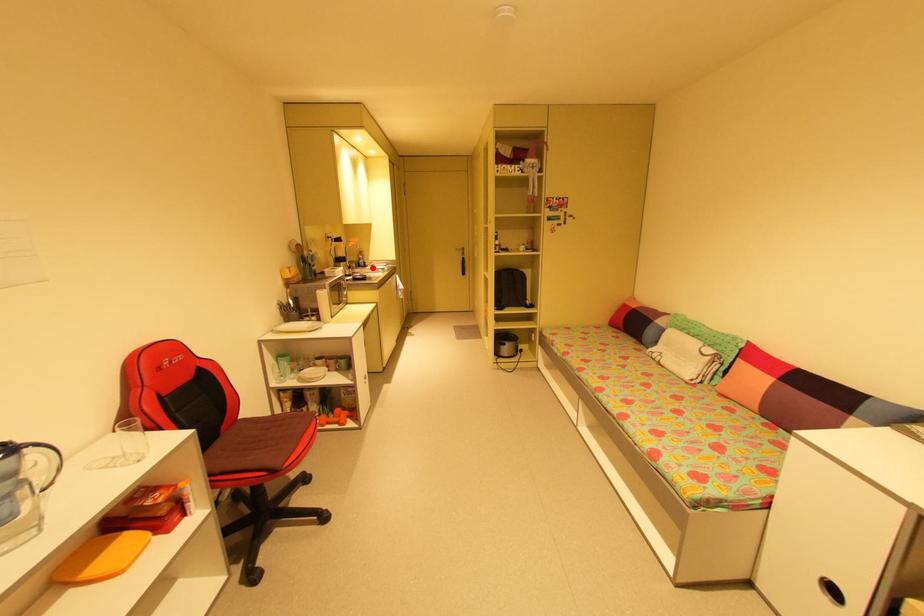
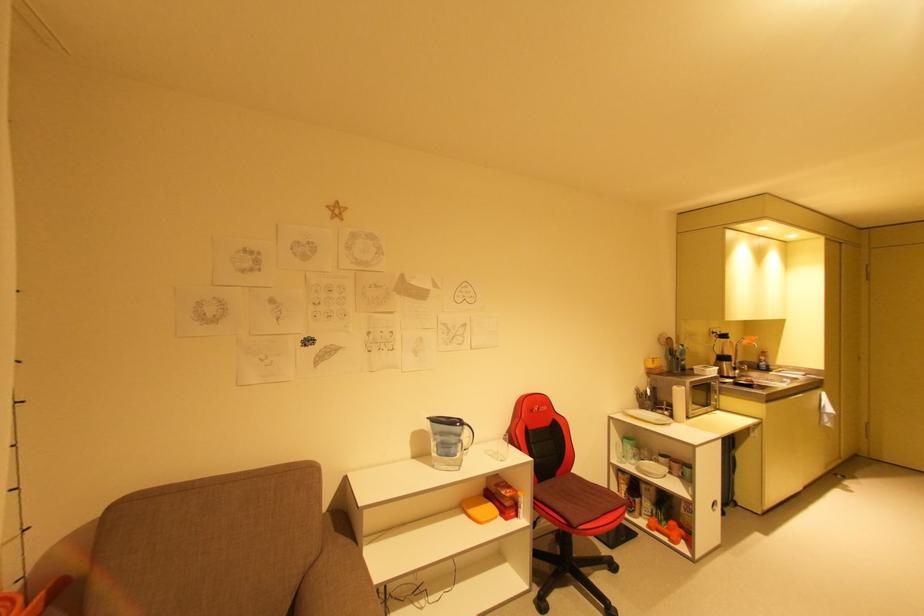
In the second image, find the point that corresponds to the highlighted location in the first image.

(776, 373)